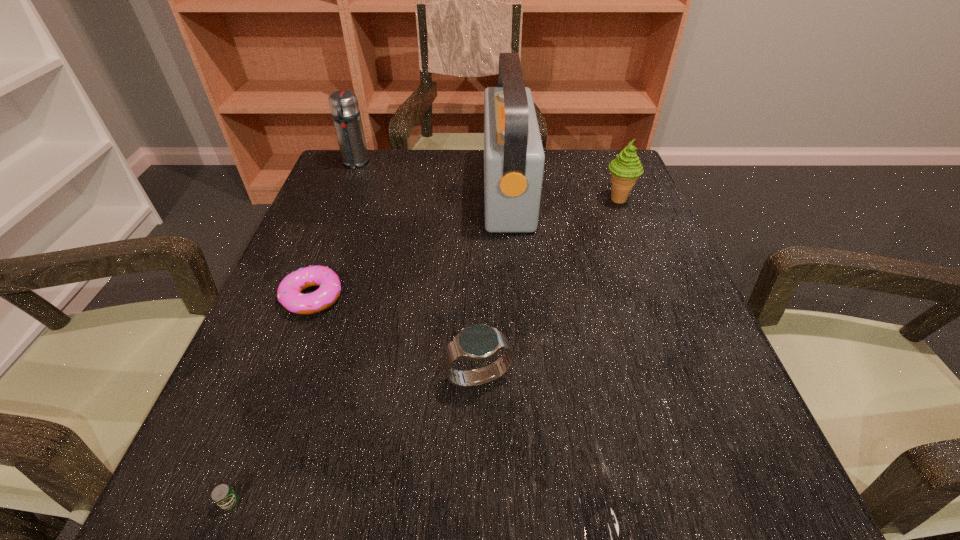
The width and height of the screenshot is (960, 540). What are the coordinates of `icecream at the far edge` in the screenshot? It's located at (625, 170).

Where is `object that is positioned at the near edge`? object that is positioned at the near edge is located at coordinates (222, 495).

Find the location of a particular element. The image size is (960, 540). thermos bottle located at the left edge is located at coordinates (344, 106).

Identify the location of doughnut at the left edge. The image size is (960, 540). (289, 294).

Find the location of a particular element. This screenshot has width=960, height=540. beer can situated at the left edge is located at coordinates (222, 495).

Where is `object located in the right edge section of the desktop`? object located in the right edge section of the desktop is located at coordinates (625, 170).

Locate an element on the screen. The height and width of the screenshot is (540, 960). object located in the far left corner section of the desktop is located at coordinates (344, 106).

Identify the location of object that is at the near left corner. (222, 495).

Find the location of `object situated at the far right corner`. object situated at the far right corner is located at coordinates (625, 170).

The width and height of the screenshot is (960, 540). I want to click on free space at the far edge of the desktop, so click(x=410, y=174).